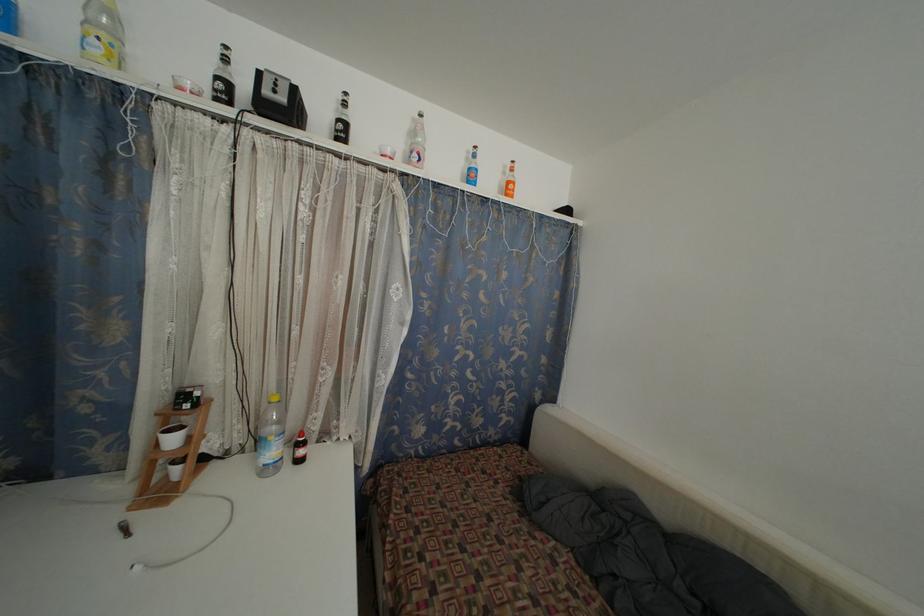
Find the location of a particular element. The height and width of the screenshot is (616, 924). small brown bottle is located at coordinates (299, 448).